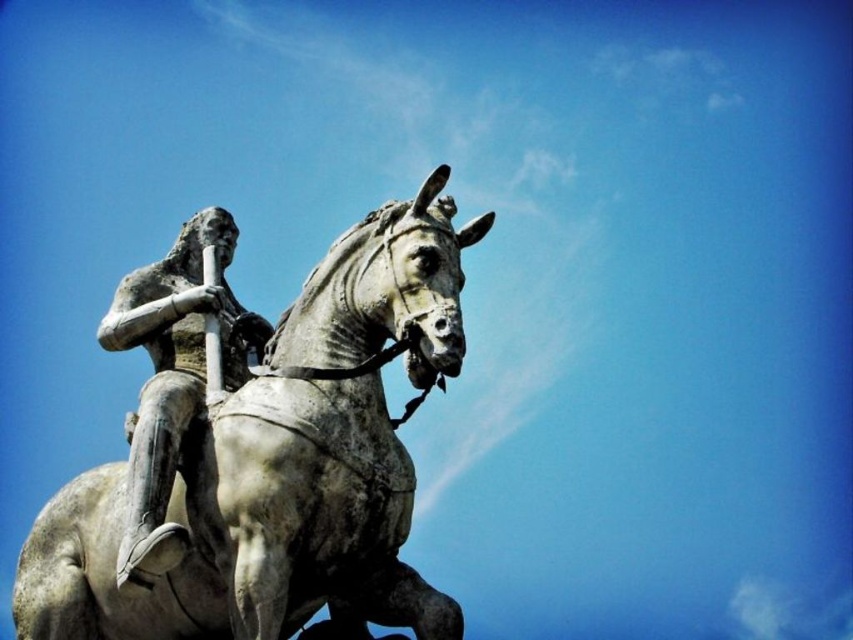
Does gray stone horse at center appear over bronze statue at center?

No, gray stone horse at center is not above bronze statue at center.

Does gray stone horse at center come behind bronze statue at center?

That is True.

Where is `gray stone horse at center`? This screenshot has width=853, height=640. gray stone horse at center is located at coordinates tap(287, 465).